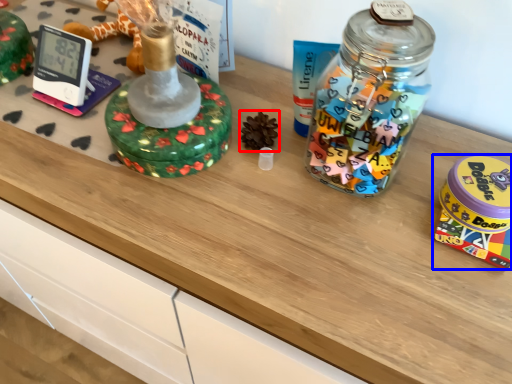
Question: Which object appears farthest to the camera in this image, toy (highlighted by a red box) or toy (highlighted by a blue box)?

Choices:
 (A) toy
 (B) toy

Answer: (A)